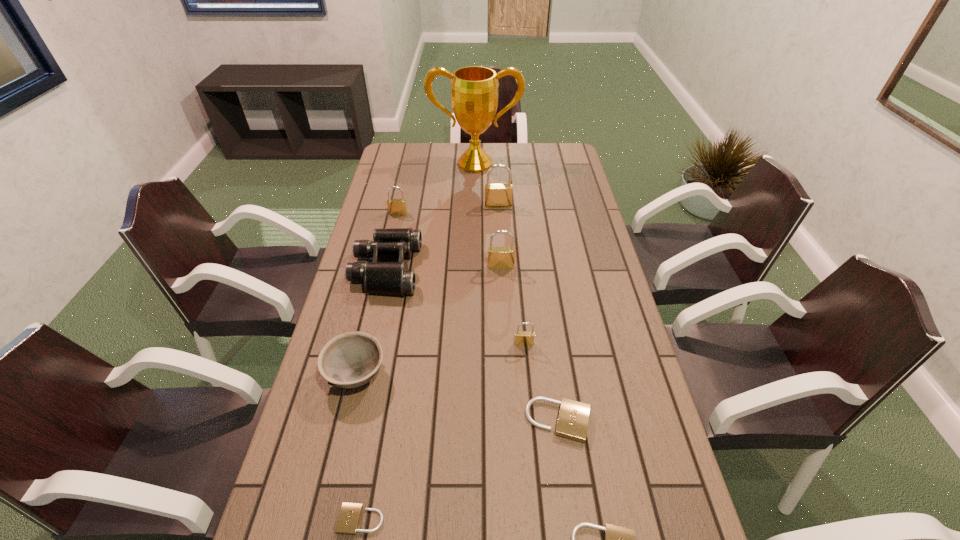
Locate an element on the screen. gold award is located at coordinates (474, 89).

The width and height of the screenshot is (960, 540). What are the coordinates of `the farthest object` in the screenshot? It's located at (474, 89).

I want to click on the tallest padlock, so click(x=496, y=195).

Locate an element on the screen. The width and height of the screenshot is (960, 540). the farthest brass padlock is located at coordinates (496, 195).

You are a GUI agent. You are given a task and a screenshot of the screen. Output one action in this format:
    pyautogui.click(x=<x>, y=<y>)
    Task: Click on the third farthest padlock
    The image size is (960, 540).
    Given the screenshot: What is the action you would take?
    pyautogui.click(x=498, y=257)

You are a GUI agent. You are given a task and a screenshot of the screen. Output one action in this format:
    pyautogui.click(x=<x>, y=<y>)
    Task: Click on the second nearest brass padlock
    The width and height of the screenshot is (960, 540).
    Given the screenshot: What is the action you would take?
    pyautogui.click(x=498, y=257)

Locate an element on the screen. the second farthest brass padlock is located at coordinates (395, 206).

I want to click on the leftmost brass padlock, so click(x=395, y=206).

What are the coordinates of `binoculars` in the screenshot? It's located at (394, 278).

Where is `the nearest brass padlock`? This screenshot has height=540, width=960. the nearest brass padlock is located at coordinates (522, 338).